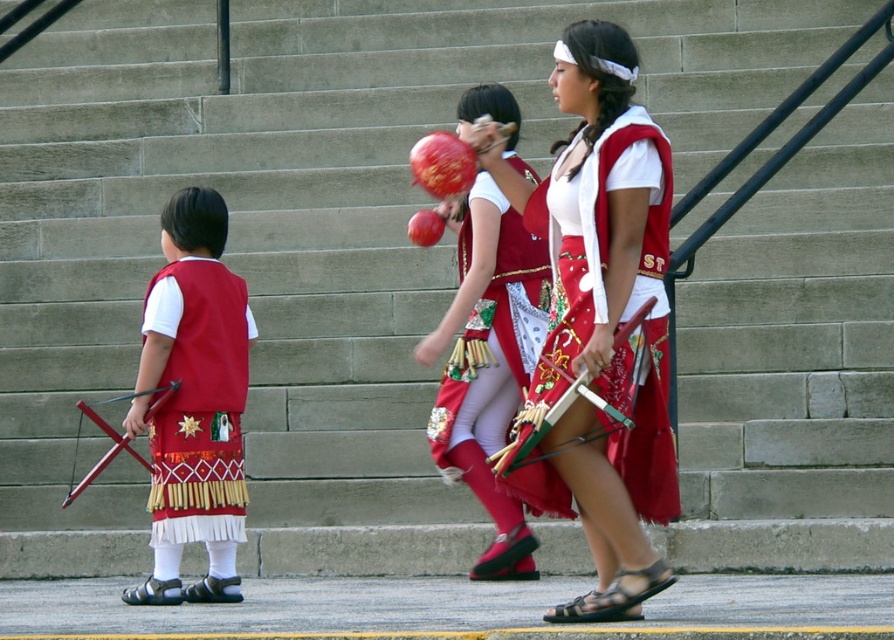
Is matte red vest at center above shiny red vest at center?

Result: No.

Can you confirm if matte red vest at center is positioned to the left of shiny red vest at center?

In fact, matte red vest at center is to the right of shiny red vest at center.

Locate an element on the screen. The height and width of the screenshot is (640, 894). matte red vest at center is located at coordinates (599, 320).

Locate an element on the screen. matte red vest at center is located at coordinates (599, 320).

Is matte red vest at left below shiny red vest at center?

Yes, matte red vest at left is below shiny red vest at center.

Does matte red vest at left have a lesser height compared to shiny red vest at center?

Indeed, matte red vest at left has a lesser height compared to shiny red vest at center.

Does point (167, 205) come closer to viewer compared to point (507, 371)?

Yes, point (167, 205) is in front of point (507, 371).

What are the coordinates of `matte red vest at left` in the screenshot? It's located at (195, 401).

From the picture: Is matte red vest at center thinner than matte red vest at left?

No, matte red vest at center is not thinner than matte red vest at left.

Between point (563, 216) and point (199, 193), which one is positioned behind?

The point (199, 193) is behind.

I want to click on matte red vest at center, so click(x=599, y=320).